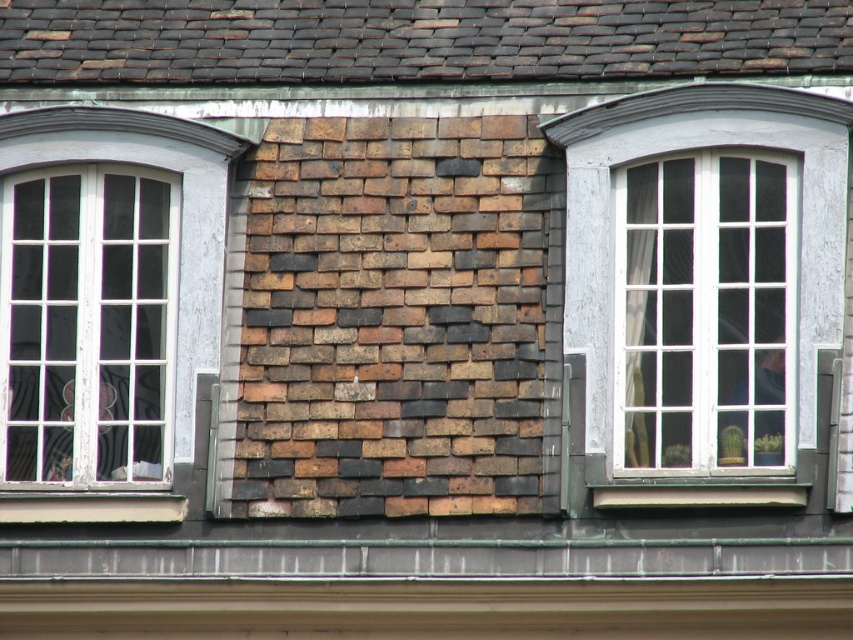
Question: Does white wooden window at left have a smaller size compared to white wood window at center?

Choices:
 (A) no
 (B) yes

Answer: (B)

Question: Where is white wood window at center located in relation to white painted wood at lower center in the image?

Choices:
 (A) right
 (B) left

Answer: (A)

Question: Which object is closer to the camera taking this photo?

Choices:
 (A) white painted wood at lower center
 (B) white wooden window at left

Answer: (A)

Question: Which object is the closest to the white painted wood at lower center?

Choices:
 (A) white wooden window at left
 (B) white wood window at center

Answer: (A)

Question: Does white wood window at center have a lesser width compared to white painted wood at lower center?

Choices:
 (A) no
 (B) yes

Answer: (A)

Question: Which of these objects is positioned farthest from the white painted wood at lower center?

Choices:
 (A) white wooden window at left
 (B) white wood window at center

Answer: (B)